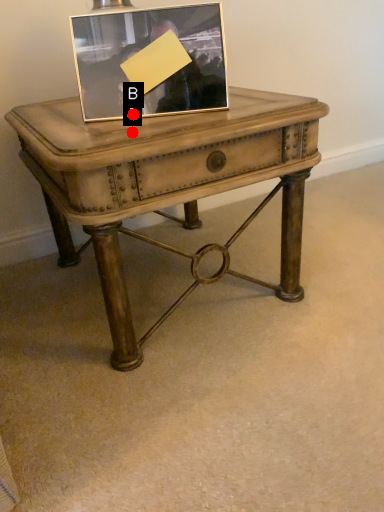
Question: Two points are circled on the image, labeled by A and B beside each circle. Which point appears farthest from the camera in this image?

Choices:
 (A) A is further
 (B) B is further

Answer: (B)